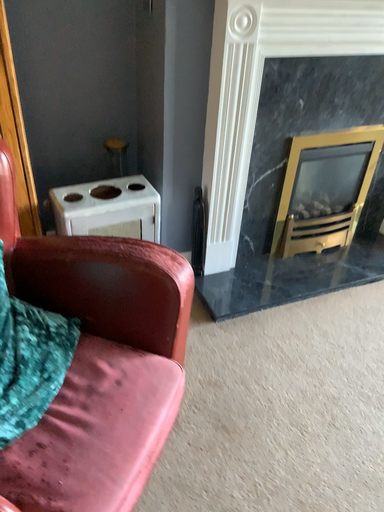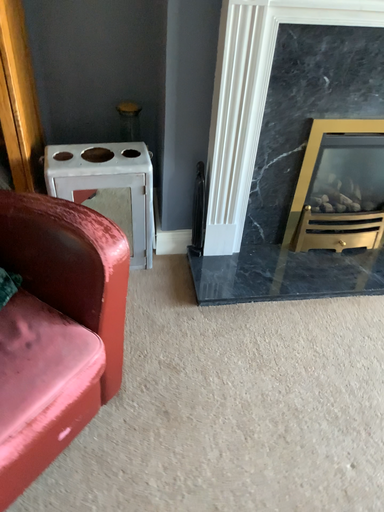
Question: Which way did the camera rotate in the video?

Choices:
 (A) rotated left
 (B) rotated right

Answer: (A)